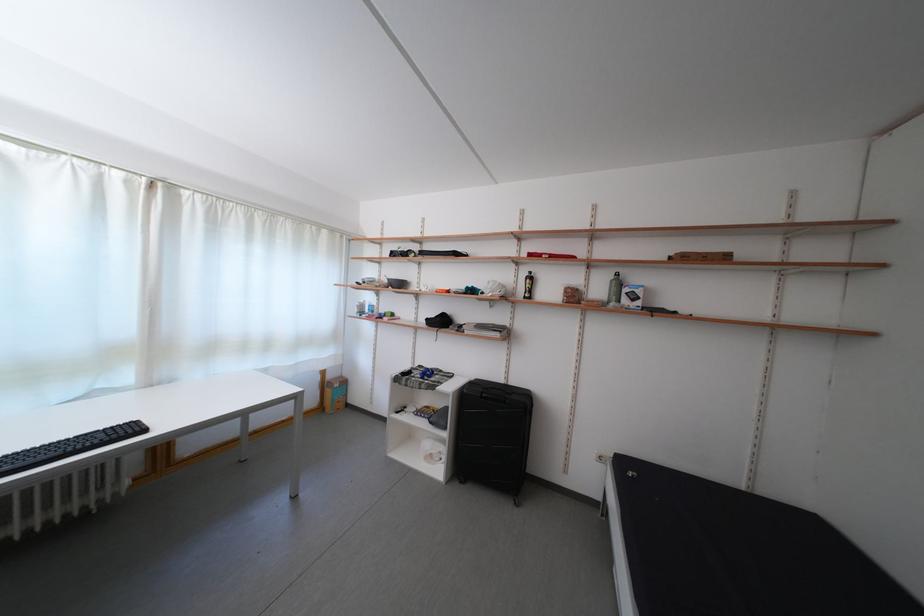
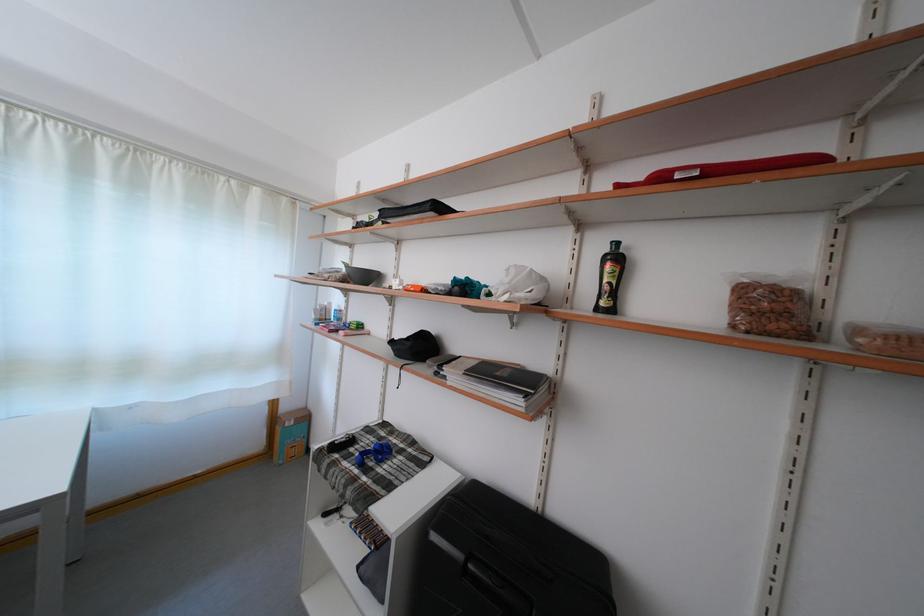
The point at (382,390) is marked in the first image. Where is the corresponding point in the second image?

(344, 436)